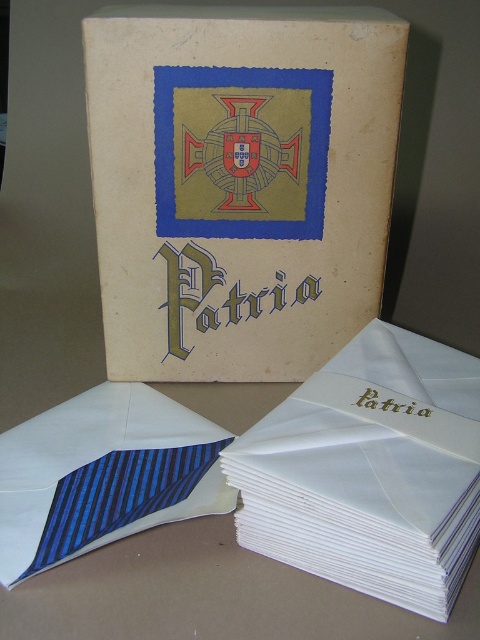
Question: Which object is closer to the camera taking this photo?

Choices:
 (A) blue striped tie at lower left
 (B) white paper book at center

Answer: (B)

Question: Can you confirm if matte cardboard box at center is positioned below blue striped tie at lower left?

Choices:
 (A) yes
 (B) no

Answer: (B)

Question: Is white paper book at center to the left of blue striped tie at lower left from the viewer's perspective?

Choices:
 (A) yes
 (B) no

Answer: (B)

Question: Which of these objects is positioned farthest from the matte cardboard box at center?

Choices:
 (A) white paper book at center
 (B) blue striped tie at lower left

Answer: (B)

Question: Which point is farther from the camera taking this photo?

Choices:
 (A) (305, 452)
 (B) (124, 262)
 (C) (84, 499)

Answer: (B)

Question: From the image, what is the correct spatial relationship of white paper book at center in relation to blue striped tie at lower left?

Choices:
 (A) above
 (B) below

Answer: (A)